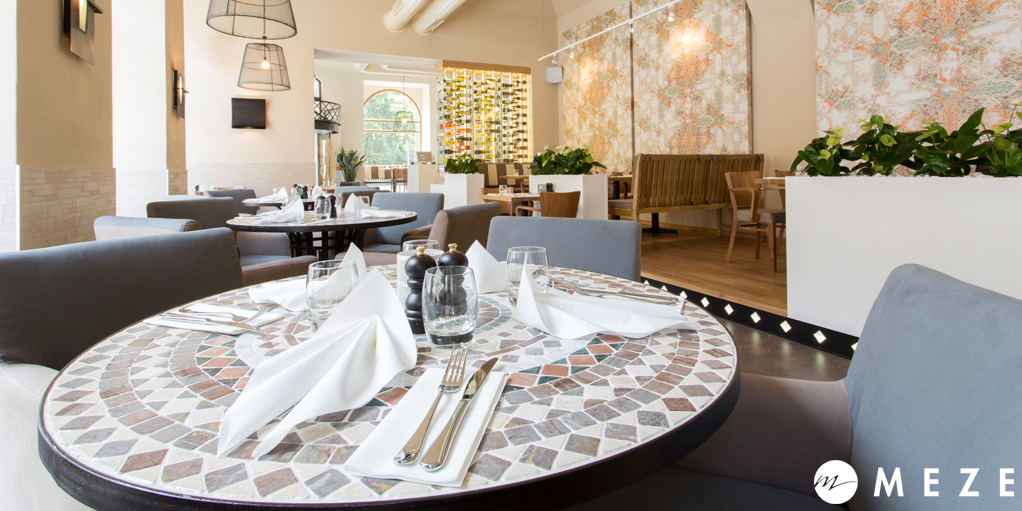
The image size is (1022, 511). What are the coordinates of `yellow diamond light` in the screenshot? It's located at (852, 343), (818, 336), (777, 326), (748, 317), (715, 307), (695, 297), (677, 292), (658, 288), (637, 280).